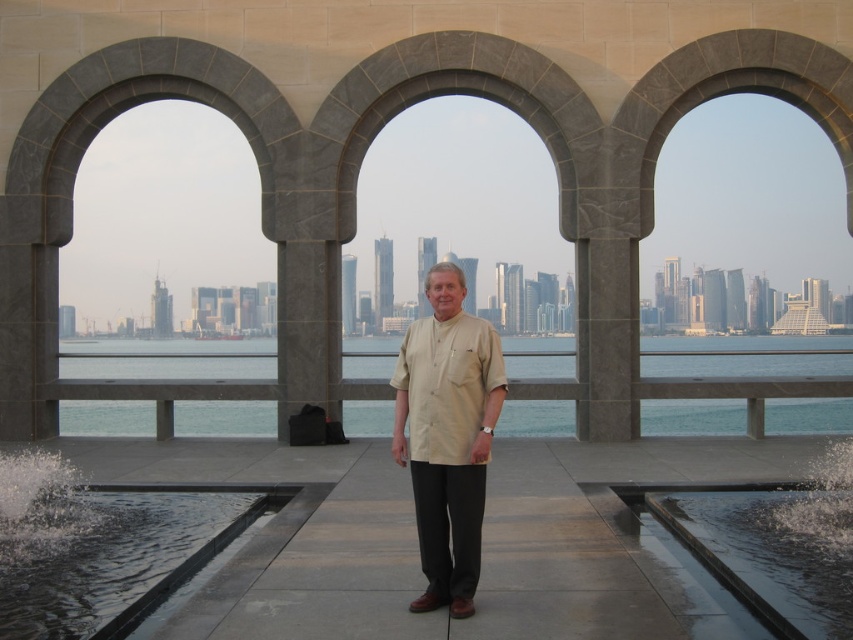
Is black smooth water at lower left behind beige cotton shirt at center?

No, it is not.

Who is shorter, black smooth water at lower left or beige cotton shirt at center?

black smooth water at lower left is shorter.

You are a GUI agent. You are given a task and a screenshot of the screen. Output one action in this format:
    pyautogui.click(x=<x>, y=<y>)
    Task: Click on the black smooth water at lower left
    
    Given the screenshot: What is the action you would take?
    pyautogui.click(x=99, y=547)

Can you confirm if blue water at center is smaller than black smooth water at lower left?

Actually, blue water at center might be larger than black smooth water at lower left.

Can you confirm if blue water at center is shorter than black smooth water at lower left?

No.

Is point (737, 355) farther from viewer compared to point (114, 570)?

Yes, it is.

The width and height of the screenshot is (853, 640). I want to click on blue water at center, so click(747, 356).

Describe the element at coordinates (747, 356) in the screenshot. I see `blue water at center` at that location.

Is blue water at center to the left of beige cotton shirt at center from the viewer's perspective?

Incorrect, blue water at center is not on the left side of beige cotton shirt at center.

Image resolution: width=853 pixels, height=640 pixels. What are the coordinates of `blue water at center` in the screenshot? It's located at (747, 356).

At what (x,y) coordinates should I click in order to perform the action: click on blue water at center. Please return your answer as a coordinate pair (x, y). Looking at the image, I should click on (747, 356).